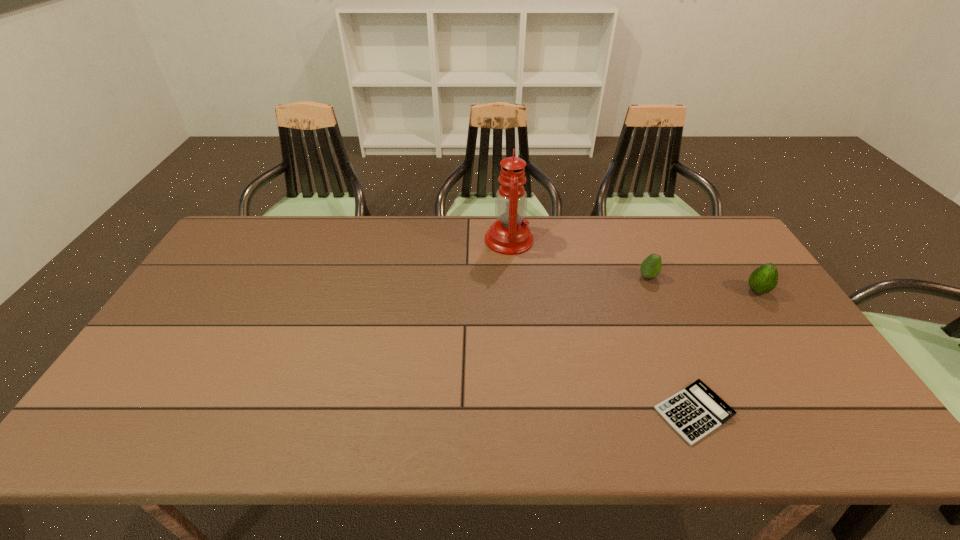
In order to click on free region located 0.220m on the back of the shortest object in this screenshot , I will do `click(656, 317)`.

This screenshot has width=960, height=540. I want to click on object that is at the far edge, so click(509, 235).

In order to click on object that is at the near edge in this screenshot , I will do coord(694,412).

The width and height of the screenshot is (960, 540). Find the location of `object situated at the right edge`. object situated at the right edge is located at coordinates (764, 279).

Identify the location of vacant space at the far edge. (419, 215).

Locate an element on the screen. The width and height of the screenshot is (960, 540). vacant space at the near edge of the desktop is located at coordinates (460, 437).

Where is `vacant space at the left edge of the desktop`? This screenshot has width=960, height=540. vacant space at the left edge of the desktop is located at coordinates (227, 294).

I want to click on free space at the far left corner, so click(227, 253).

Where is `empty space that is in between the shorter avocado and the calculator`? Image resolution: width=960 pixels, height=540 pixels. empty space that is in between the shorter avocado and the calculator is located at coordinates (671, 345).

Where is `empty location between the left avocado and the shortest object`? This screenshot has height=540, width=960. empty location between the left avocado and the shortest object is located at coordinates (671, 345).